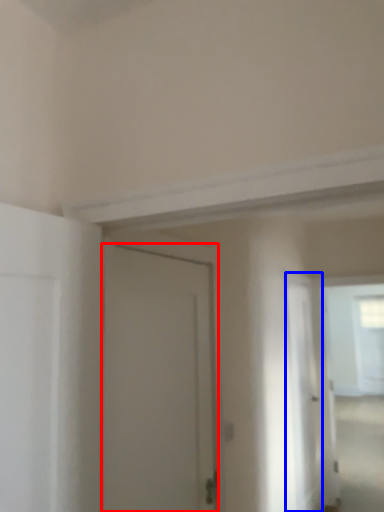
Question: Which object is further to the camera taking this photo, door (highlighted by a red box) or screen door (highlighted by a blue box)?

Choices:
 (A) door
 (B) screen door

Answer: (B)